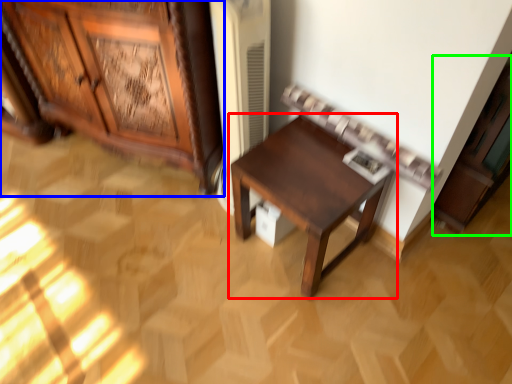
Question: Estimate the real-world distances between objects in this image. Which object is closer to table (highlighted by a red box), cabinetry (highlighted by a blue box) or cabinetry (highlighted by a green box)?

Choices:
 (A) cabinetry
 (B) cabinetry

Answer: (B)